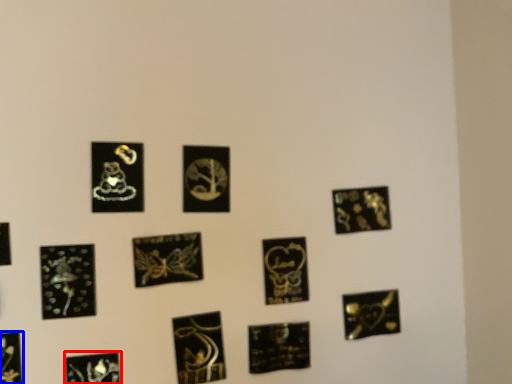
Question: Which object is further to the camera taking this photo, picture frame (highlighted by a red box) or picture frame (highlighted by a blue box)?

Choices:
 (A) picture frame
 (B) picture frame

Answer: (A)